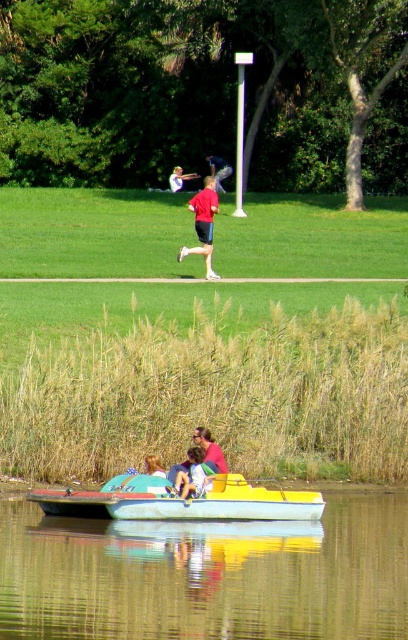
You are standing on the dock and looking at the smooth reflective water at lower center and the blue fabric shirt at center. Which object appears taller from your perspective?

The blue fabric shirt at center appears taller than the smooth reflective water at lower center because the water has a lesser height compared to the shirt.

You are standing at the center of the park and want to find the smooth reflective water at lower center. According to the coordinates provided, in which direction should you move to locate it?

The smooth reflective water at lower center is located at point 0.900 on the x axis and 0.510 on the y axis. Since you are at the center of the park, which is at coordinates (204, 320), you should move towards the right and slightly upwards to reach it.

You are a photographer standing at the edge of the water. You want to take a photo that includes both the smooth reflective water at lower center and the blue fabric shirt at center. Which object should you zoom in on to ensure both are clearly visible in the frame?

The smooth reflective water at lower center is smaller than the blue fabric shirt at center, so you should zoom in on the blue fabric shirt at center to ensure both are clearly visible in the frame.